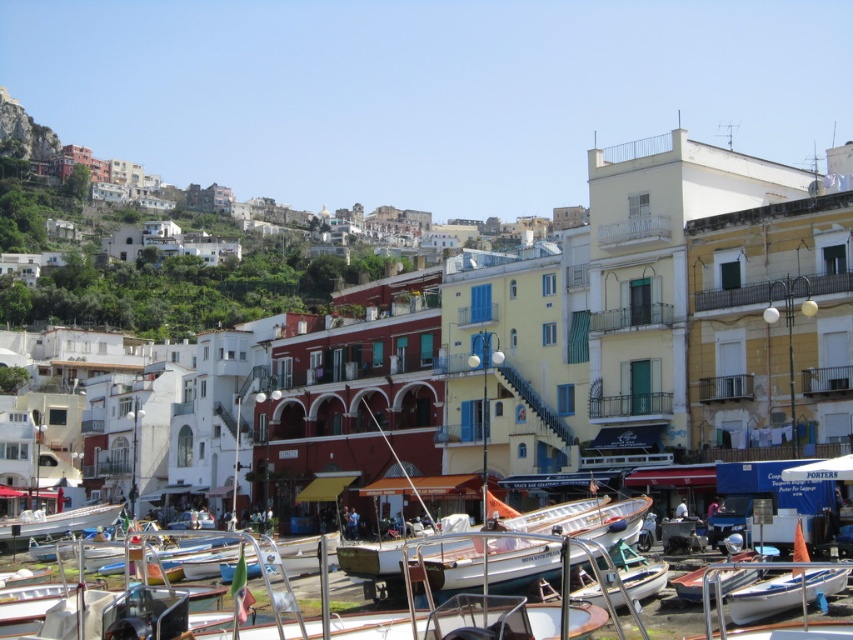
You are a photographer standing at the edge of the pier. You want to take a photo of the white glossy boat at lower right and the white wooden boat at lower right. However, you notice that one boat is blocking the view of the other. Which boat is blocking the other one?

The white glossy boat at lower right is positioned over the white wooden boat at lower right, so it is blocking the view of the white wooden boat at lower right.

Based on the photo, you are a tour guide leading a group of visitors to a boat that is 130 feet long. You see the white glossy boat at lower left and the white wooden boat at lower right in the harbor. Which boat can accommodate the group if the boat must be at least 130 feet long?

The white glossy boat at lower left and the white wooden boat at lower right are separated by a distance of 134.40 feet. However, the question is about the length of the boats themselves, not the distance between them. Since the provided information does not specify the lengths of the individual boats, it is impossible to determine which one can accommodate the group based on the given data.

You are standing at the edge of the pier and want to board the closest boat. Which boat should you choose between the white glossy boat at lower right and the white wooden boat at lower right?

You should choose the white glossy boat at lower right because it is closer to the viewer than the white wooden boat at lower right.